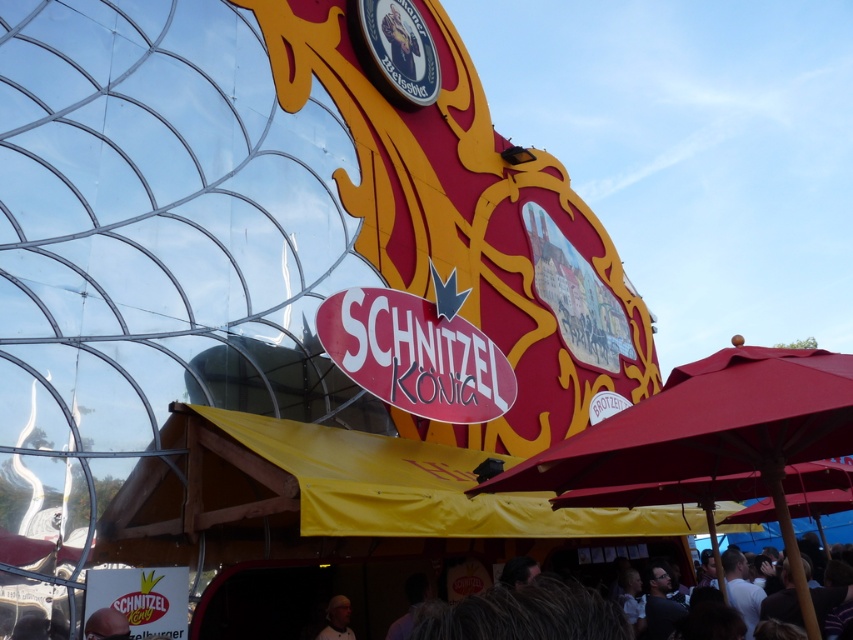
Between matte red umbrella at lower right and matte black helmet at lower left, which one has less height?

Standing shorter between the two is matte black helmet at lower left.

Is matte red umbrella at lower right above matte black helmet at lower left?

Correct, matte red umbrella at lower right is located above matte black helmet at lower left.

Who is more distant from viewer, (x=775, y=486) or (x=107, y=628)?

Point (x=107, y=628)

In order to click on matte red umbrella at lower right in this screenshot , I will do `click(712, 433)`.

Does point (111, 637) come in front of point (341, 605)?

Yes, point (111, 637) is closer to viewer.

Who is shorter, matte black helmet at lower left or white matte hair at lower center?

Standing shorter between the two is matte black helmet at lower left.

The width and height of the screenshot is (853, 640). What do you see at coordinates (106, 625) in the screenshot? I see `matte black helmet at lower left` at bounding box center [106, 625].

You are a GUI agent. You are given a task and a screenshot of the screen. Output one action in this format:
    pyautogui.click(x=<x>, y=<y>)
    Task: Click on the matte black helmet at lower left
    This screenshot has width=853, height=640.
    Given the screenshot: What is the action you would take?
    pyautogui.click(x=106, y=625)

Between matte red umbrella at lower right and white matte hair at lower center, which one appears on the left side from the viewer's perspective?

white matte hair at lower center is more to the left.

Which is below, matte red umbrella at lower right or white matte hair at lower center?

white matte hair at lower center is below.

Locate an element on the screen. matte red umbrella at lower right is located at coordinates (712, 433).

You are a GUI agent. You are given a task and a screenshot of the screen. Output one action in this format:
    pyautogui.click(x=<x>, y=<y>)
    Task: Click on the matte red umbrella at lower right
    The height and width of the screenshot is (640, 853).
    Given the screenshot: What is the action you would take?
    pyautogui.click(x=712, y=433)